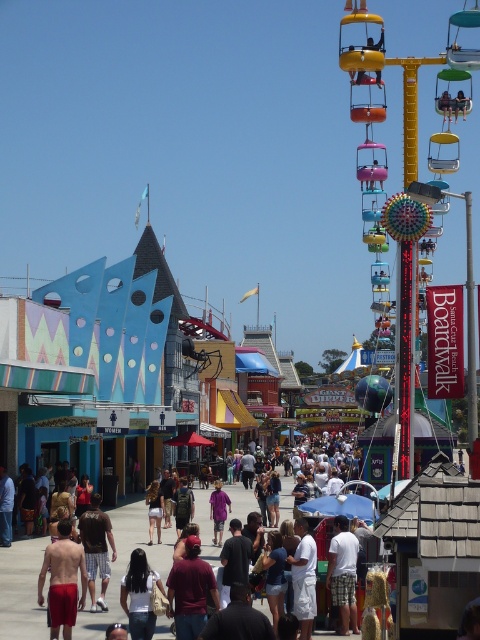
Question: Is red matte shorts at lower left smaller than white cotton shirt at center?

Choices:
 (A) yes
 (B) no

Answer: (B)

Question: Which point is farther to the camera?

Choices:
 (A) white cotton shirt at center
 (B) brown cotton t-shirt at center
 (C) red matte shorts at lower left

Answer: (B)

Question: Which object is positioned farthest from the brown cotton t-shirt at center?

Choices:
 (A) red matte shorts at lower left
 (B) white cotton shirt at center

Answer: (B)

Question: Among these points, which one is nearest to the camera?

Choices:
 (A) (337, 632)
 (B) (46, 568)
 (C) (106, 540)

Answer: (B)

Question: Does red matte shorts at lower left lie behind white cotton shirt at center?

Choices:
 (A) yes
 (B) no

Answer: (B)

Question: Does white cotton shirt at center appear on the right side of brown cotton t-shirt at center?

Choices:
 (A) no
 (B) yes

Answer: (B)